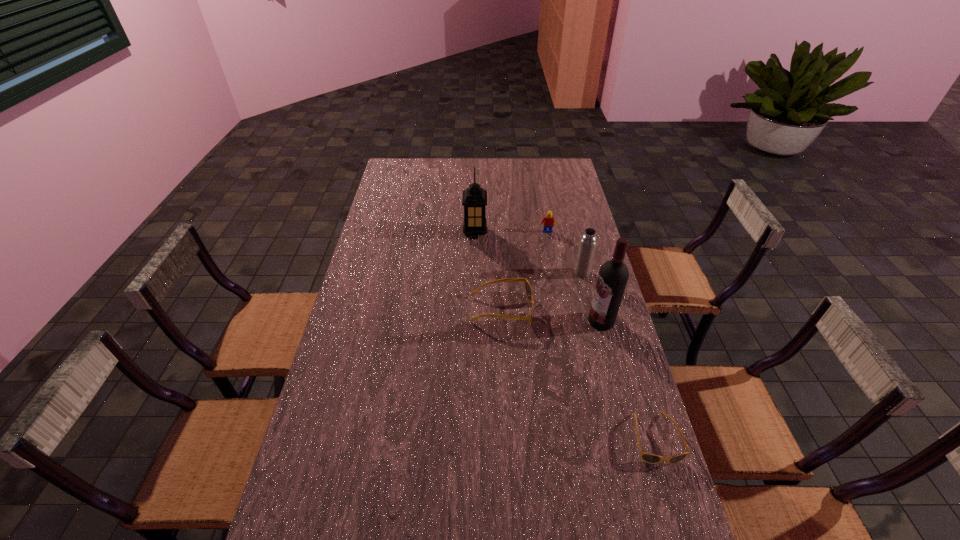
This screenshot has height=540, width=960. I want to click on the farther sunglasses, so click(528, 288).

Identify the location of the left sunglasses. The image size is (960, 540). (528, 288).

Image resolution: width=960 pixels, height=540 pixels. Identify the location of the right sunglasses. (650, 458).

The width and height of the screenshot is (960, 540). Find the location of `the shortest object`. the shortest object is located at coordinates tap(650, 458).

At what (x,y) coordinates should I click in order to perform the action: click on the second tallest object. Please return your answer as a coordinate pair (x, y). Looking at the image, I should click on (474, 199).

Locate an element on the screen. The height and width of the screenshot is (540, 960). the third shortest object is located at coordinates (548, 221).

Identify the location of the third object from left to right. (548, 221).

At what (x,y) coordinates should I click in order to perform the action: click on wine bottle. Please return your answer as a coordinate pair (x, y). The width and height of the screenshot is (960, 540). Looking at the image, I should click on (612, 279).

I want to click on the fourth shortest object, so click(x=588, y=242).

Find the location of `the fourth nearest object`. the fourth nearest object is located at coordinates (588, 242).